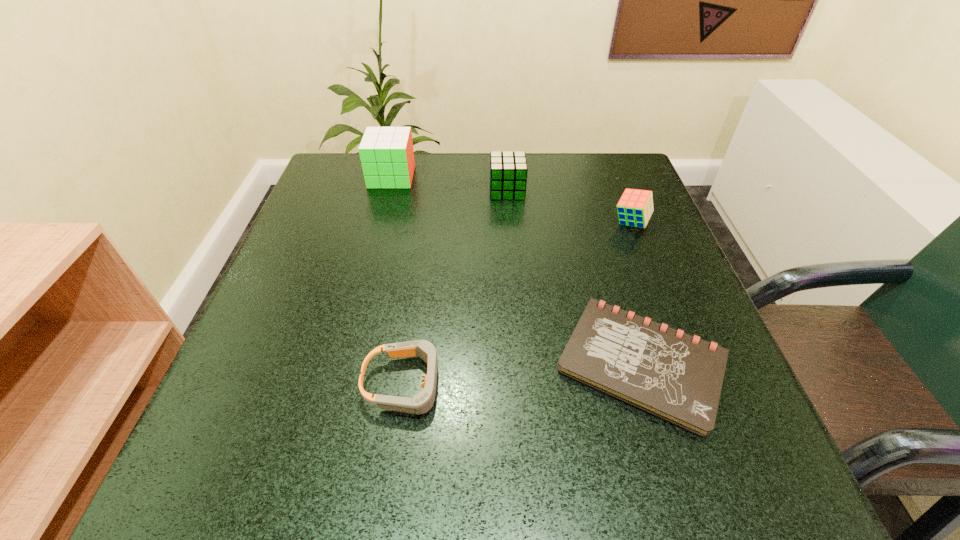
Locate an element on the screen. Image resolution: width=960 pixels, height=540 pixels. vacant space located 0.390m on the front and back of the second shortest object is located at coordinates (706, 383).

I want to click on free space located on the back of the shortest object, so click(x=588, y=190).

Identify the location of object located at the near edge. (677, 377).

Find the location of `object that is at the left edge`. object that is at the left edge is located at coordinates (386, 153).

Locate an element on the screen. Image resolution: width=960 pixels, height=540 pixels. cube located in the right edge section of the desktop is located at coordinates (635, 207).

Find the location of a particular element. The width and height of the screenshot is (960, 540). notebook that is at the right edge is located at coordinates (677, 377).

Identify the location of object located in the far left corner section of the desktop. (x=386, y=153).

Identify the location of object positioned at the near right corner. The width and height of the screenshot is (960, 540). (677, 377).

What are the coordinates of `vacant area at the far edge of the desktop` in the screenshot? It's located at (573, 188).

Find the location of a particular element. The height and width of the screenshot is (540, 960). free space at the near edge of the desktop is located at coordinates (512, 478).